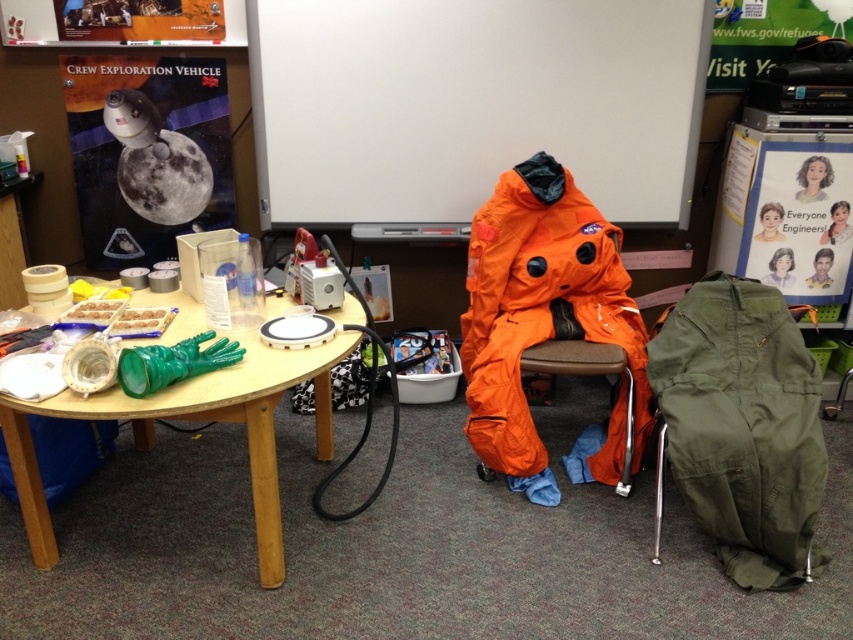
You are organizing a space exploration workshop and need to place a large educational banner on the wall. The banner is slightly larger than the matte paper poster at upper right. Will the olive green fabric at lower right be big enough to cover the banner?

The olive green fabric at lower right is bigger than the matte paper poster at upper right, so yes, the olive green fabric at lower right will be big enough to cover the banner since it is larger than the poster.

You are an astronaut preparing for a mission and need to pack your equipment. You have an orange fabric at center and a matte plastic poster at upper left in the room. Which item can you take without needing to fold or adjust its size because it is larger?

The orange fabric at center is bigger than the matte plastic poster at upper left, so you can take the orange fabric at center without needing to fold or adjust its size because it is larger.